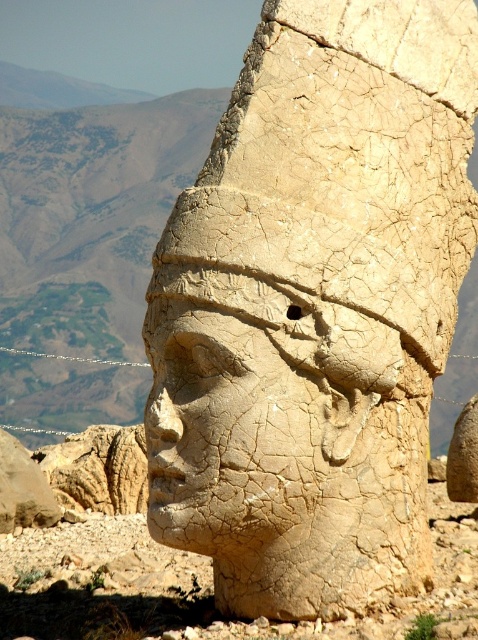
You are an archaeologist examining the sculpture. You notice two parts of the sculpture labeled as the cracked stone head at center and the cracked stone face at center. Which part is positioned higher up on the sculpture?

The cracked stone head at center is located above the cracked stone face at center, so the cracked stone head at center is positioned higher up on the sculpture.

Consider the image. You are an archaeologist examining the sculpture. You notice two parts of the sculpture labeled as the cracked stone head at center and the cracked stone face at center. Which one is located to the right of the other?

The cracked stone head at center is positioned on the right side of cracked stone face at center.